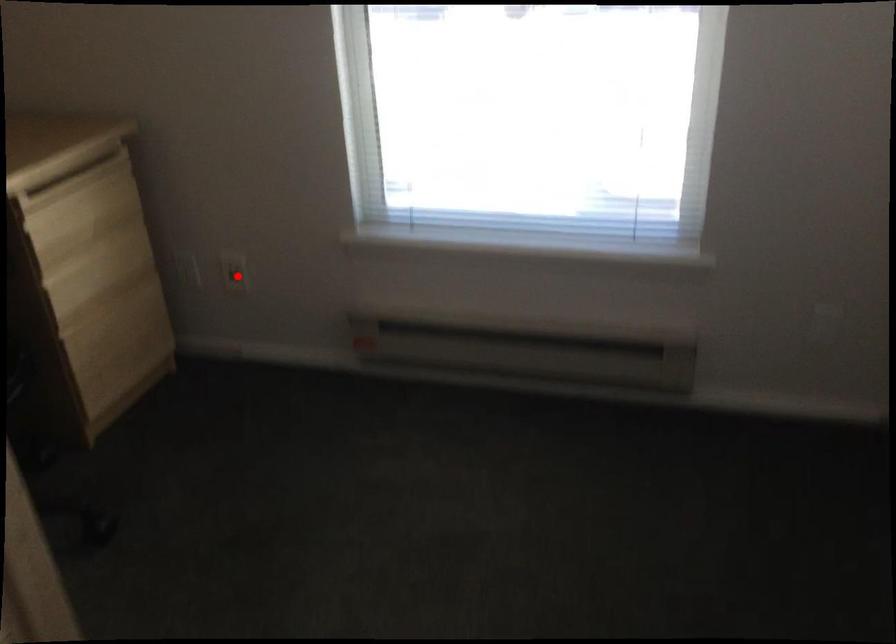
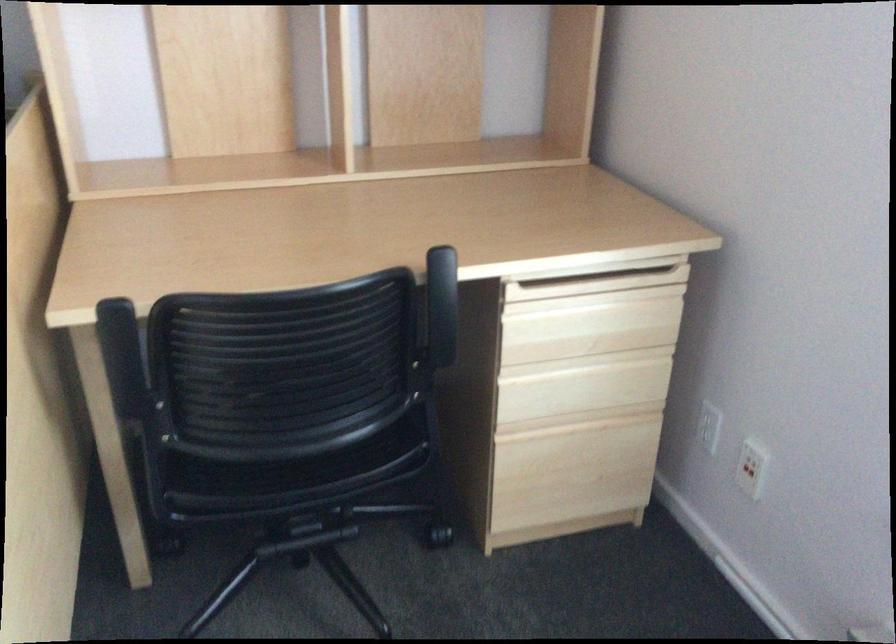
Question: A red point is marked in image1. In image2, is the corresponding 3D point closer to the camera or farther? Reply with the corresponding letter.

Choices:
 (A) The corresponding 3D point is closer.
 (B) The corresponding 3D point is farther.

Answer: (A)